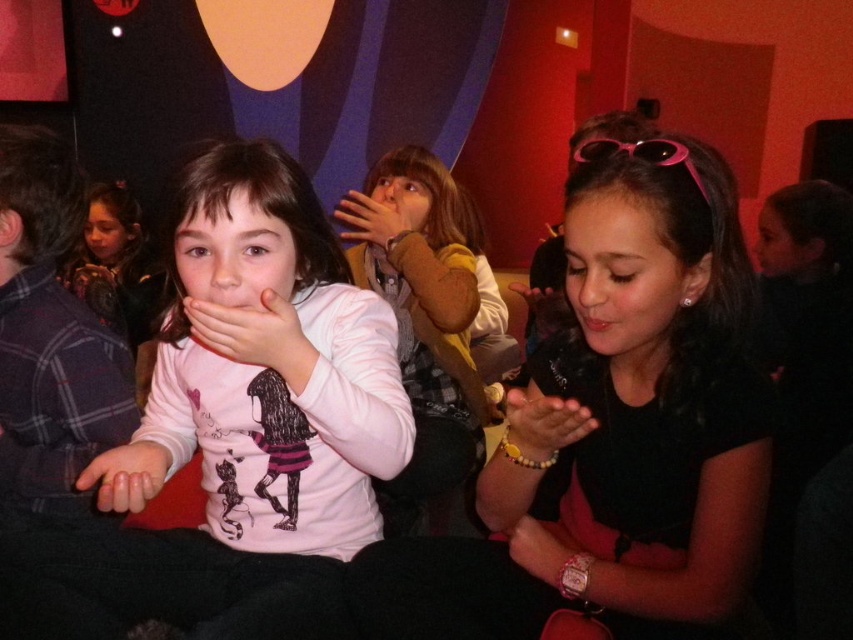
Question: Can you confirm if matte brown sweater at center is thinner than matte pink hand at center?

Choices:
 (A) yes
 (B) no

Answer: (B)

Question: Does black matte shirt at center have a larger size compared to white matte shirt at center?

Choices:
 (A) no
 (B) yes

Answer: (B)

Question: Among these objects, which one is nearest to the camera?

Choices:
 (A) smooth pink skin at lower left
 (B) black matte shirt at center
 (C) matte brown sweater at center

Answer: (B)

Question: Which point is farther to the camera?

Choices:
 (A) white matte shirt at center
 (B) smooth beige hand at center

Answer: (A)

Question: Can you confirm if matte brown sweater at center is bigger than smooth beige hand at center?

Choices:
 (A) no
 (B) yes

Answer: (B)

Question: Which point is farther to the camera?

Choices:
 (A) (141, 476)
 (B) (363, 211)
 (C) (561, 552)
 (D) (303, 460)

Answer: (B)